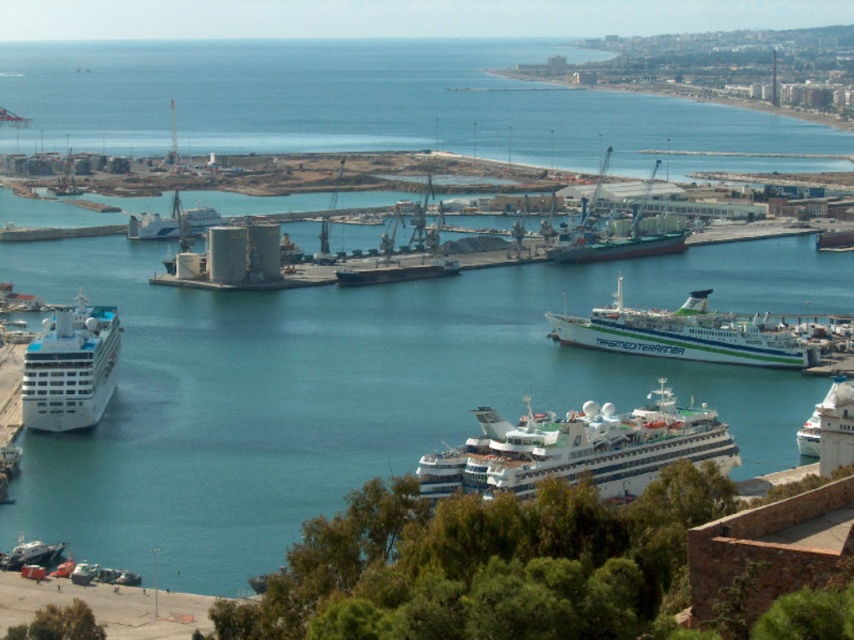
Based on the photo, can you confirm if clear blue water at center is shorter than white glossy cruise ship at lower right?

No, clear blue water at center is not shorter than white glossy cruise ship at lower right.

Does point (129, 422) lie behind point (841, 378)?

No, it is in front of (841, 378).

Is point (278, 358) farther from camera compared to point (832, 392)?

That is False.

Where is `clear blue water at center`? clear blue water at center is located at coordinates (355, 388).

Which is more to the left, white glossy cruise ship at center-right or white glossy cruise ship at lower left?

white glossy cruise ship at lower left

Which is behind, point (732, 314) or point (101, 394)?

The point (101, 394) is behind.

The height and width of the screenshot is (640, 854). Describe the element at coordinates (683, 333) in the screenshot. I see `white glossy cruise ship at center-right` at that location.

The width and height of the screenshot is (854, 640). Find the location of `white glossy cruise ship at center-right`. white glossy cruise ship at center-right is located at coordinates (683, 333).

Is white glossy cruise ship at lower left to the right of white glossy ferry at center from the viewer's perspective?

In fact, white glossy cruise ship at lower left is to the left of white glossy ferry at center.

Who is more distant from viewer, [85,397] or [174,227]?

The point [85,397] is behind.

Between point (71, 346) and point (180, 211), which one is positioned in front?

Point (180, 211) is in front.

I want to click on white glossy cruise ship at lower left, so click(x=69, y=368).